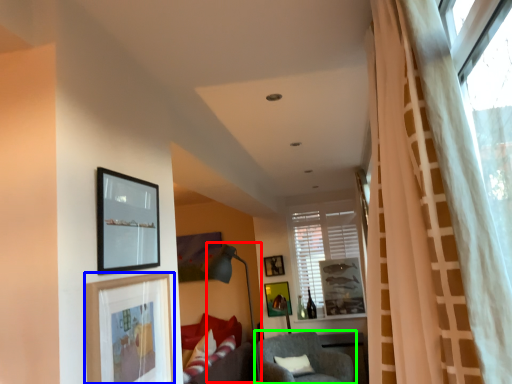
Question: Considering the real-world distances, which object is closest to lamp (highlighted by a red box)? picture frame (highlighted by a blue box) or chair (highlighted by a green box).

Choices:
 (A) picture frame
 (B) chair

Answer: (B)